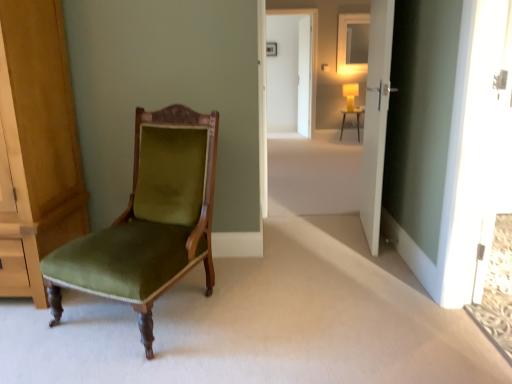
Image resolution: width=512 pixels, height=384 pixels. Describe the element at coordinates (304, 78) in the screenshot. I see `white glossy door at center, which is the first door from back to front` at that location.

What do you see at coordinates (291, 72) in the screenshot?
I see `white glossy screen door at center` at bounding box center [291, 72].

Describe the element at coordinates (271, 49) in the screenshot. This screenshot has height=384, width=512. I see `matte white picture frame at upper center` at that location.

You are a GUI agent. You are given a task and a screenshot of the screen. Output one action in this format:
    pyautogui.click(x=<x>, y=<y>)
    Task: Click on the white matte door at center, the 2th door viewed from the back
    This screenshot has width=512, height=384.
    Given the screenshot: What is the action you would take?
    pyautogui.click(x=376, y=118)

Can you tell me how much white glossy door at center, the 1th door positioned from the top, and matte yellow lampshade at center differ in facing direction?

The angle between the facing direction of white glossy door at center, the 1th door positioned from the top, and the facing direction of matte yellow lampshade at center is 81.8 degrees.

Which point is more forward, (307, 94) or (353, 92)?

Point (307, 94)

Is white glossy door at center, which appears as the second door when ordered from the bottom, oriented away from matte yellow lampshade at center?

white glossy door at center, which appears as the second door when ordered from the bottom, does not have its back to matte yellow lampshade at center.

Do you think white glossy door at center, the 1th door positioned from the top, is within matte yellow lampshade at center, or outside of it?

white glossy door at center, the 1th door positioned from the top, is located beyond the bounds of matte yellow lampshade at center.

Does matte white mirror at upper center lie in front of matte yellow lampshade at center?

No.

Between matte white mirror at upper center and matte yellow lampshade at center, which one has larger size?

With larger size is matte yellow lampshade at center.

Between matte white mirror at upper center and matte yellow lampshade at center, which one appears on the right side from the viewer's perspective?

Positioned to the right is matte white mirror at upper center.

Which is less distant, (358,69) or (355,93)?

The point (358,69) is closer.

Is point (376, 184) positioned after point (368, 68)?

No, (376, 184) is in front of (368, 68).

Consider the image. Would you say white matte door at center, the 2th door viewed from the back, is inside or outside matte yellow lampshade at center?

white matte door at center, the 2th door viewed from the back, lies outside matte yellow lampshade at center.

Are white matte door at center, which ranks as the 1th door in bottom-to-top order, and matte yellow lampshade at center beside each other?

white matte door at center, which ranks as the 1th door in bottom-to-top order, and matte yellow lampshade at center are clearly separated.

Is white matte door at center, the 2th door viewed from the back, oriented towards matte yellow lampshade at center?

Yes, white matte door at center, the 2th door viewed from the back, is aimed at matte yellow lampshade at center.

From a real-world perspective, which object stands above the other?

From a 3D spatial view, matte yellow lampshade at center is above.

Consider the image. Is matte white desk at center not close to matte yellow lampshade at center?

They are positioned close to each other.

Does point (342, 112) appear closer or farther from the camera than point (349, 98)?

Point (342, 112) is positioned farther from the camera compared to point (349, 98).

Between matte white desk at center and matte yellow lampshade at center, which one has larger width?

With larger width is matte white desk at center.

Considering the relative positions of matte white picture frame at upper center and white glossy screen door at center in the image provided, is matte white picture frame at upper center to the left of white glossy screen door at center from the viewer's perspective?

Yes.

Which of these two, matte white picture frame at upper center or white glossy screen door at center, is smaller?

With smaller size is matte white picture frame at upper center.

From the image's perspective, which one is positioned higher, matte white picture frame at upper center or white glossy screen door at center?

matte white picture frame at upper center appears higher in the image.

Is matte white picture frame at upper center positioned with its back to white glossy screen door at center?

matte white picture frame at upper center does not have its back to white glossy screen door at center.

Looking at this image, which object is thinner, matte white desk at center or white glossy screen door at center?

With smaller width is white glossy screen door at center.

Who is smaller, matte white desk at center or white glossy screen door at center?

matte white desk at center is smaller.

Could you tell me if matte white desk at center is facing white glossy screen door at center?

No, matte white desk at center is not aimed at white glossy screen door at center.

From the image's perspective, between matte white desk at center and white glossy screen door at center, which one is located above?

From the image's view, white glossy screen door at center is above.

The image size is (512, 384). What are the coordinates of `mirror above the white glossy screen door at center (from a real-world perspective)` in the screenshot? It's located at (345, 43).

Does matte white mirror at upper center have a greater width compared to white glossy screen door at center?

No, matte white mirror at upper center is not wider than white glossy screen door at center.

Is matte white mirror at upper center far from white glossy screen door at center?

Actually, matte white mirror at upper center and white glossy screen door at center are a little close together.

In the image, there is a matte yellow lampshade at center. Where is `door above it (from the image's perspective)`? door above it (from the image's perspective) is located at coordinates (304, 78).

Locate an element on the screen. lamp lying below the matte white mirror at upper center (from the image's perspective) is located at coordinates (350, 94).

Estimate the real-world distances between objects in this image. Which object is closer to white glossy door at center, which is the first door from back to front, matte yellow lampshade at center or white matte door at center, which ranks as the 1th door in bottom-to-top order?

white matte door at center, which ranks as the 1th door in bottom-to-top order, is positioned closer to the anchor white glossy door at center, which is the first door from back to front.

When comparing their distances from white glossy screen door at center, does white matte door at center, the second door positioned from the top, or matte white mirror at upper center seem closer?

matte white mirror at upper center is closer to white glossy screen door at center.

When comparing their distances from matte white desk at center, does velvet green chair at left or white glossy door at center, which appears as the second door when ordered from the bottom, seem closer?

Based on the image, white glossy door at center, which appears as the second door when ordered from the bottom, appears to be nearer to matte white desk at center.

Looking at the image, which one is located further to matte yellow lampshade at center, white glossy door at center, which appears as the second door when ordered from the bottom, or matte yellow lampshade at center?

matte yellow lampshade at center lies further to matte yellow lampshade at center than the other object.

Based on their spatial positions, is matte white desk at center or white glossy door at center, which is the first door from back to front, further from white matte door at center, the first door when ordered from front to back?

matte white desk at center is positioned further to the anchor white matte door at center, the first door when ordered from front to back.

Based on the photo, from the image, which object appears to be nearer to white glossy door at center, which appears as the second door when ordered from the bottom, matte white mirror at upper center or velvet green chair at left?

matte white mirror at upper center is positioned closer to the anchor white glossy door at center, which appears as the second door when ordered from the bottom.

Which object lies further to the anchor point white glossy door at center, which is the first door from back to front, matte yellow lampshade at center or white matte door at center, the second door positioned from the top?

white matte door at center, the second door positioned from the top.

When comparing their distances from matte white mirror at upper center, does white glossy screen door at center or velvet green chair at left seem closer?

white glossy screen door at center.

At what (x,y) coordinates should I click in order to perform the action: click on corridor positioned between velvet green chair at left and matte white mirror at upper center from near to far. Please return your answer as a coordinate pair (x, y). Image resolution: width=512 pixels, height=384 pixels. Looking at the image, I should click on (375, 115).

Locate an element on the screen. This screenshot has width=512, height=384. lamp positioned between velvet green chair at left and white glossy screen door at center from near to far is located at coordinates (350, 94).

Locate an element on the screen. mirror located between velvet green chair at left and white glossy door at center, which appears as the second door when ordered from the bottom, in the depth direction is located at coordinates (345, 43).

Find the location of a particular element. The width and height of the screenshot is (512, 384). corridor between velvet green chair at left and matte yellow lampshade at center along the z-axis is located at coordinates (375, 115).